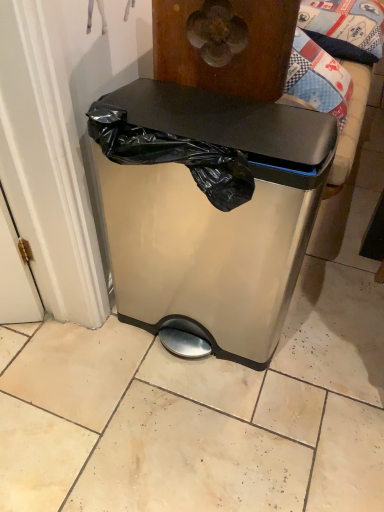
Where is `vacant space to the left of satin silver trash can at center`? vacant space to the left of satin silver trash can at center is located at coordinates tap(66, 372).